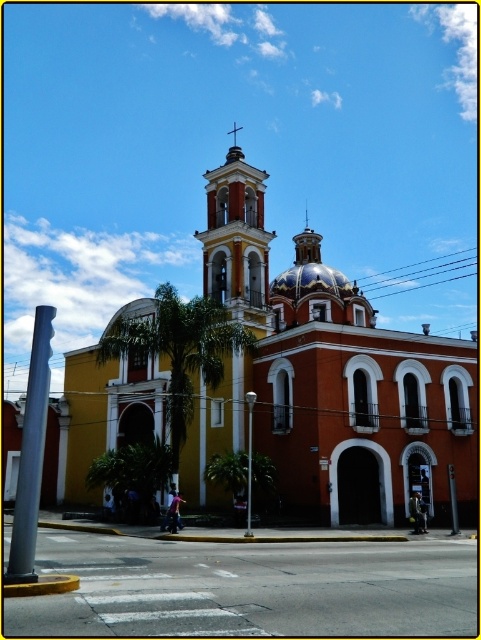
You are standing in front of the church and want to take a photo of both the orange stucco church at center and the matte orange bell tower at center. Which one should you focus on first if you want to capture both in the frame?

The orange stucco church at center is positioned on the right side of matte orange bell tower at center, so you should focus on the matte orange bell tower at center first to ensure both are in the frame.

Looking at this image, you are standing in front of the church and want to take a photo of the orange stucco church at center and the matte orange bell tower at center. Which one should you focus on first if you want to capture both in the frame without moving your camera?

The orange stucco church at center is below the matte orange bell tower at center, so you should focus on the matte orange bell tower at center first to ensure both are in the frame.

You are standing in front of the church and want to place a decorative wreath on the widest part of the building. Which object should you choose between the orange stucco church at center and the matte orange bell tower at center?

The orange stucco church at center might be wider than matte orange bell tower at center, so you should place the wreath on the orange stucco church at center.